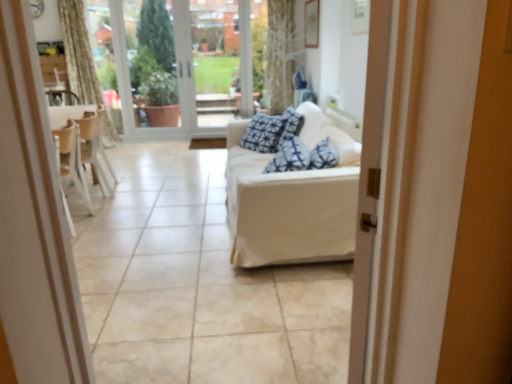
The height and width of the screenshot is (384, 512). Describe the element at coordinates (215, 59) in the screenshot. I see `transparent glass door at center` at that location.

The height and width of the screenshot is (384, 512). What do you see at coordinates (292, 200) in the screenshot?
I see `white fabric couch at center` at bounding box center [292, 200].

Where is `transparent glass door at center`? The width and height of the screenshot is (512, 384). transparent glass door at center is located at coordinates (215, 59).

From the image's perspective, which is above, wooden chair at left or white fabric couch at center?

From the image's view, wooden chair at left is above.

Can you confirm if wooden chair at left is wider than white fabric couch at center?

No.

Is wooden chair at left further to camera compared to white fabric couch at center?

Yes, wooden chair at left is further from the viewer.

In terms of size, does white glass door at upper center appear bigger or smaller than white fabric couch at center?

white glass door at upper center is smaller than white fabric couch at center.

Is point (139, 87) closer to viewer compared to point (140, 227)?

That is False.

In the scene shown: Is the surface of white glass door at upper center in direct contact with white fabric couch at center?

No, white glass door at upper center is not making contact with white fabric couch at center.

From a real-world perspective, who is located lower, white glass door at upper center or white fabric couch at center?

white fabric couch at center, from a real-world perspective.

In the scene shown: Is wooden chair at left with transparent glass door at center?

No, wooden chair at left is not beside transparent glass door at center.

Is transparent glass door at center at the back of wooden chair at left?

No, wooden chair at left is not facing away from transparent glass door at center.

Is wooden chair at left wider than transparent glass door at center?

Correct, the width of wooden chair at left exceeds that of transparent glass door at center.

Visually, is wooden chair at left positioned to the left or to the right of transparent glass door at center?

wooden chair at left is to the left of transparent glass door at center.

Is point (204, 24) closer to viewer compared to point (224, 120)?

Yes.

From the image's perspective, does transparent glass door at center appear lower than white glass door at upper center?

No, from the image's perspective, transparent glass door at center is not beneath white glass door at upper center.

Considering the relative positions of transparent glass door at center and white glass door at upper center in the image provided, is transparent glass door at center to the left of white glass door at upper center from the viewer's perspective?

Incorrect, transparent glass door at center is not on the left side of white glass door at upper center.

Considering the relative sizes of white fabric couch at center and white glass door at upper center in the image provided, is white fabric couch at center smaller than white glass door at upper center?

Result: No, white fabric couch at center is not smaller than white glass door at upper center.

From the image's perspective, is white fabric couch at center located beneath white glass door at upper center?

Yes.

Considering the relative sizes of white fabric couch at center and white glass door at upper center in the image provided, is white fabric couch at center thinner than white glass door at upper center?

Incorrect, the width of white fabric couch at center is not less than that of white glass door at upper center.

In the scene shown: Is white fabric couch at center facing away from wooden chair at left?

No, white fabric couch at center's orientation is not away from wooden chair at left.

How much distance is there between white fabric couch at center and wooden chair at left?

white fabric couch at center is 1.89 meters from wooden chair at left.

Choose the correct answer: Is white fabric couch at center inside wooden chair at left or outside it?

white fabric couch at center is not enclosed by wooden chair at left.

Measure the distance from white fabric couch at center to white glass door at upper center.

10.19 feet.

Between white fabric couch at center and white glass door at upper center, which one has larger width?

Wider between the two is white fabric couch at center.

From their relative heights in the image, would you say white fabric couch at center is taller or shorter than white glass door at upper center?

Considering their sizes, white fabric couch at center has less height than white glass door at upper center.

From a real-world perspective, between white fabric couch at center and white glass door at upper center, who is vertically higher?

In real-world perspective, white glass door at upper center is above.

Image resolution: width=512 pixels, height=384 pixels. I want to click on studio couch located above the wooden chair at left (from a real-world perspective), so pyautogui.click(x=292, y=200).

Where is `tile below the white glass door at upper center (from the image's perspective)`? Image resolution: width=512 pixels, height=384 pixels. tile below the white glass door at upper center (from the image's perspective) is located at coordinates (197, 284).

Based on their spatial positions, is white fabric couch at center or white glass door at upper center closer to transparent glass door at center?

white glass door at upper center is closer to transparent glass door at center.

From the image, which object appears to be farther from transparent glass door at center, white fabric couch at center or white fabric couch at center?

The object further to transparent glass door at center is white fabric couch at center.

From the image, which object appears to be farther from white glass door at upper center, white fabric couch at center or transparent glass door at center?

white fabric couch at center is positioned further to the anchor white glass door at upper center.

From the image, which object appears to be nearer to transparent glass door at center, wooden chair at left or white glass door at upper center?

Among the two, white glass door at upper center is located nearer to transparent glass door at center.

From the image, which object appears to be nearer to wooden chair at left, transparent glass door at center or white fabric couch at center?

The object closer to wooden chair at left is white fabric couch at center.

Estimate the real-world distances between objects in this image. Which object is closer to white fabric couch at center, wooden chair at left or white fabric couch at center?

Based on the image, white fabric couch at center appears to be nearer to white fabric couch at center.

Which object lies further to the anchor point white fabric couch at center, white glass door at upper center or transparent glass door at center?

transparent glass door at center is positioned further to the anchor white fabric couch at center.

Which object lies further to the anchor point white fabric couch at center, white glass door at upper center or transparent glass door at center?

white glass door at upper center is positioned further to the anchor white fabric couch at center.

At what (x,y) coordinates should I click in order to perform the action: click on chair between white fabric couch at center and white glass door at upper center from front to back. Please return your answer as a coordinate pair (x, y). The height and width of the screenshot is (384, 512). Looking at the image, I should click on (92, 146).

Locate an element on the screen. Image resolution: width=512 pixels, height=384 pixels. bay window between wooden chair at left and transparent glass door at center along the z-axis is located at coordinates (176, 63).

Locate an element on the screen. studio couch located between white fabric couch at center and white glass door at upper center in the depth direction is located at coordinates [292, 200].

Locate an element on the screen. chair located between white fabric couch at center and transparent glass door at center in the depth direction is located at coordinates (92, 146).